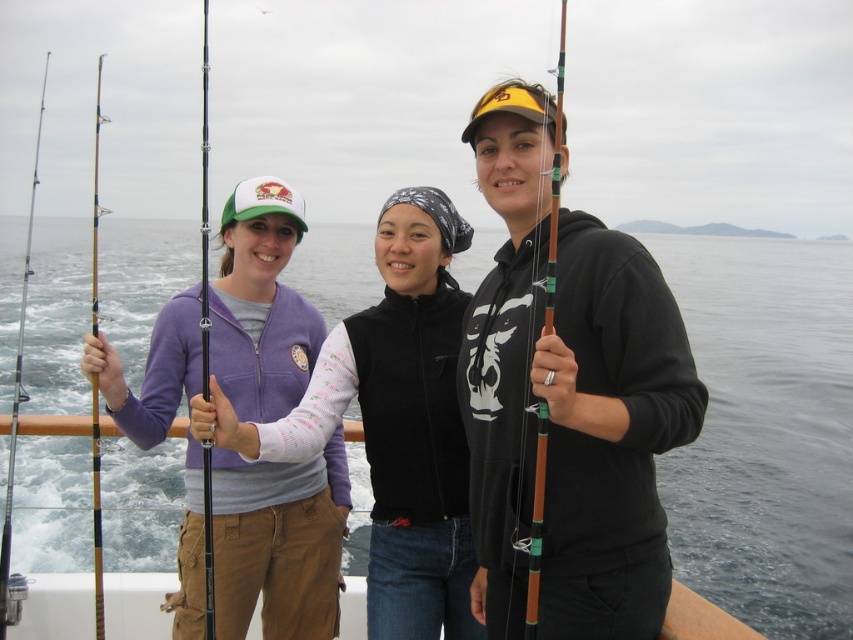
Question: Is clear water at center above black matte fishing pole at left?

Choices:
 (A) no
 (B) yes

Answer: (A)

Question: Which object is positioned closest to the matte purple fleece at center?

Choices:
 (A) black matte fishing pole at left
 (B) matte purple jacket at left
 (C) wooden fishing pole at left

Answer: (B)

Question: Can you confirm if matte purple fleece at center is thinner than black matte fishing pole at left?

Choices:
 (A) yes
 (B) no

Answer: (A)

Question: Is matte purple jacket at left thinner than wooden fishing pole at left?

Choices:
 (A) no
 (B) yes

Answer: (B)

Question: Which object appears farthest from the camera in this image?

Choices:
 (A) matte purple jacket at left
 (B) wooden fishing pole at left
 (C) matte black hoodie at center

Answer: (A)

Question: Which of the following is the farthest from the observer?

Choices:
 (A) (459, 586)
 (B) (227, 625)

Answer: (A)